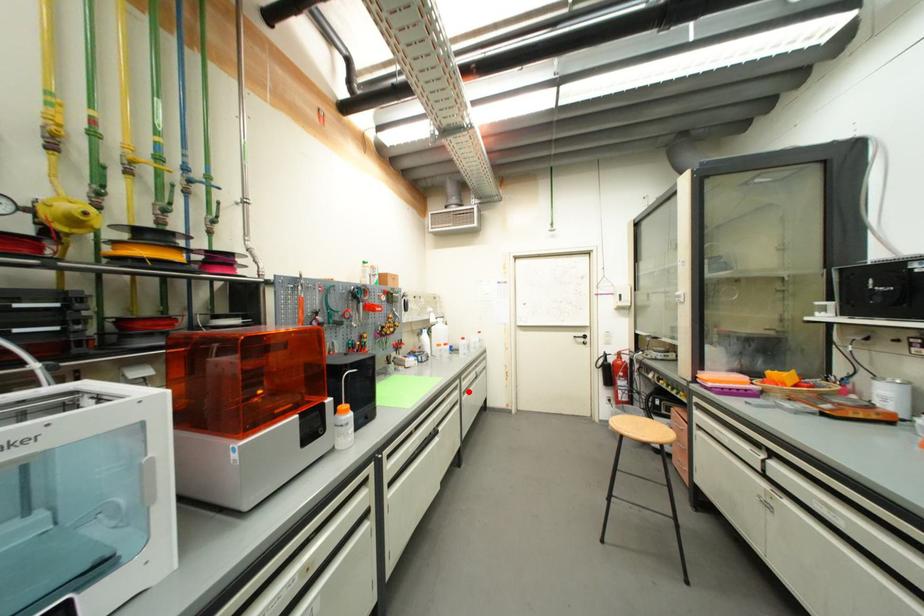
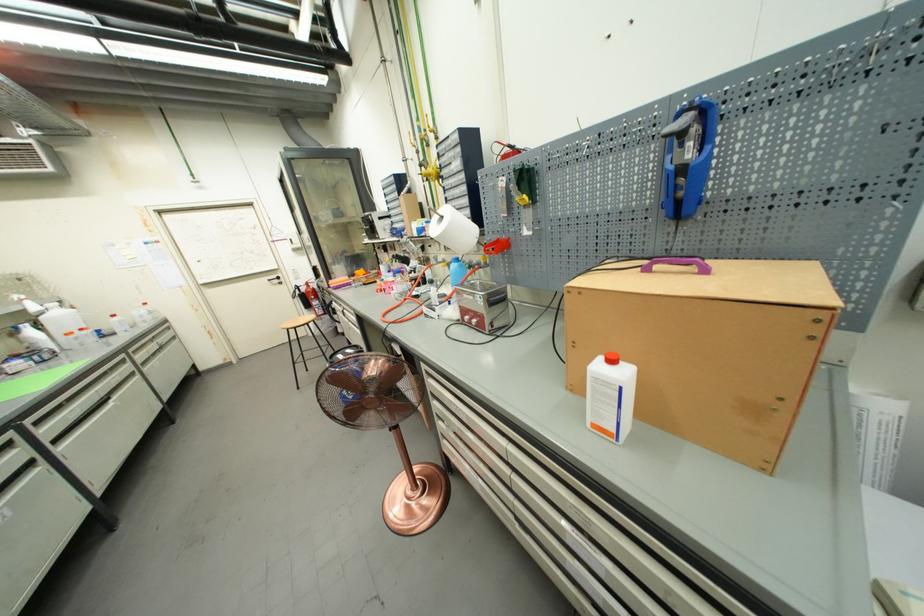
Find the pixel in the second image that matches the highlighted location in the first image.

(146, 363)